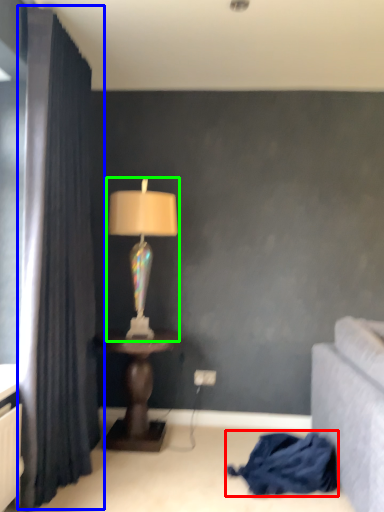
Question: Considering the real-world distances, which object is closest to blanket (highlighted by a red box)? curtain (highlighted by a blue box) or lamp (highlighted by a green box).

Choices:
 (A) curtain
 (B) lamp

Answer: (B)